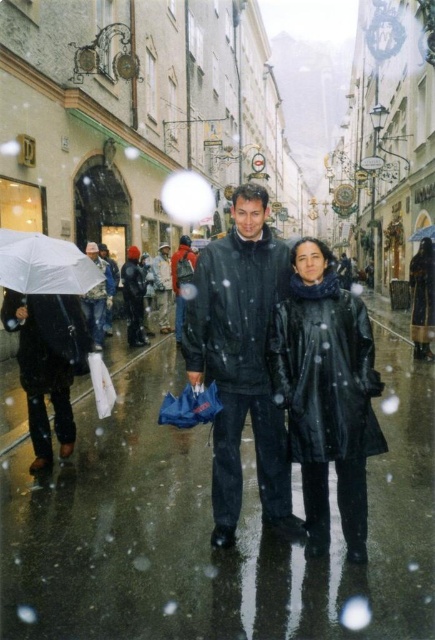
You are a tailor who needs to determine which coat requires longer fabric. Based on the image, which coat is taller between the black leather coat at center and the camouflage jacket at left?

The black leather coat at center is taller than the camouflage jacket at left, so it requires more fabric.

You are a pedestrian trying to cross the street in the rainy and snowy weather. You see the black leather coat at center and the white matte umbrella at left. Which object is closer to the left side of the street?

The white matte umbrella at left is closer to the left side of the street because it is positioned to the left of the black leather coat at center.